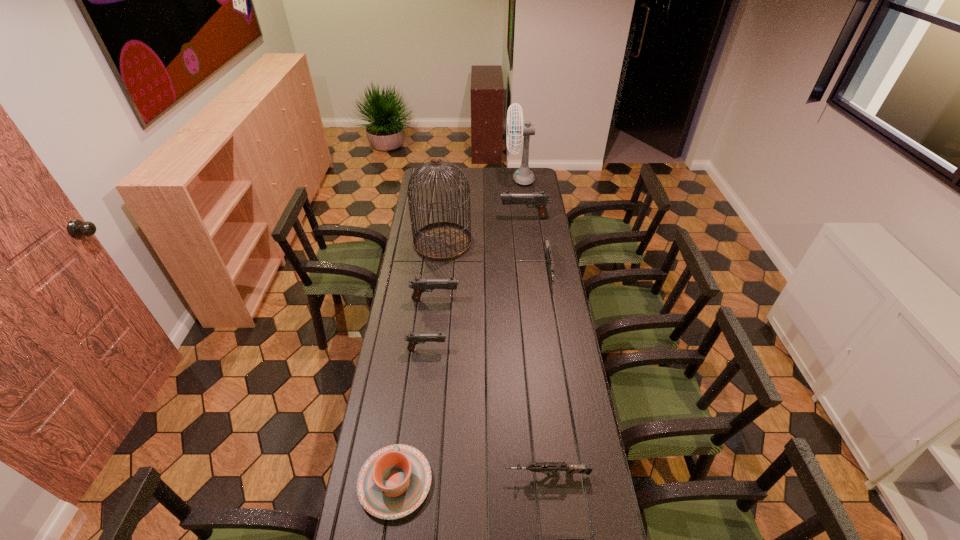
This screenshot has height=540, width=960. I want to click on object that is at the far edge, so click(x=524, y=176).

Locate an element on the screen. The width and height of the screenshot is (960, 540). birdcage located at the left edge is located at coordinates (442, 241).

What are the coordinates of `chinaware present at the left edge` in the screenshot? It's located at (394, 481).

This screenshot has width=960, height=540. I want to click on fan positioned at the right edge, so click(524, 176).

At what (x,y) coordinates should I click in order to perform the action: click on object at the far right corner. Please return your answer as a coordinate pair (x, y). Looking at the image, I should click on (524, 176).

Identify the location of vacant space at the far edge of the desktop. Image resolution: width=960 pixels, height=540 pixels. (458, 177).

This screenshot has height=540, width=960. In the image, there is a desktop. What are the coordinates of `vacant space at the left edge` in the screenshot? It's located at (408, 305).

Where is `free location at the right edge of the desktop`? free location at the right edge of the desktop is located at coordinates (573, 363).

The image size is (960, 540). I want to click on free spot at the far left corner of the desktop, so click(x=436, y=173).

Locate an element on the screen. vacant area that lies between the pink chinaware and the farthest grey gun is located at coordinates (472, 376).